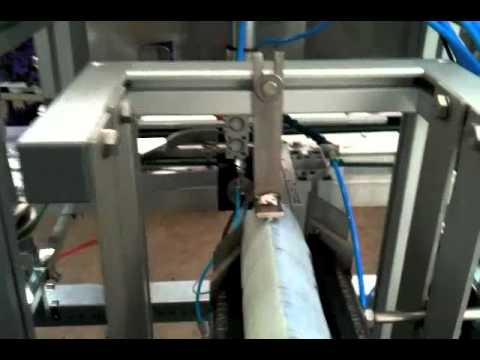
You are a GUI agent. You are given a task and a screenshot of the screen. Output one action in this format:
    pyautogui.click(x=<x>, y=<y>)
    Task: Click on the bar
    The image size is (480, 360).
    Given the screenshot: What is the action you would take?
    pyautogui.click(x=391, y=312)